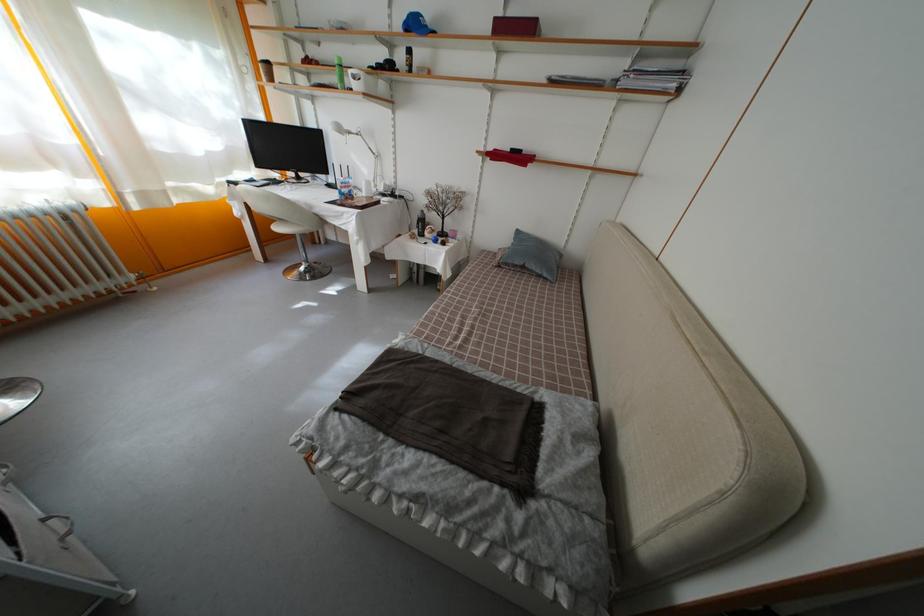
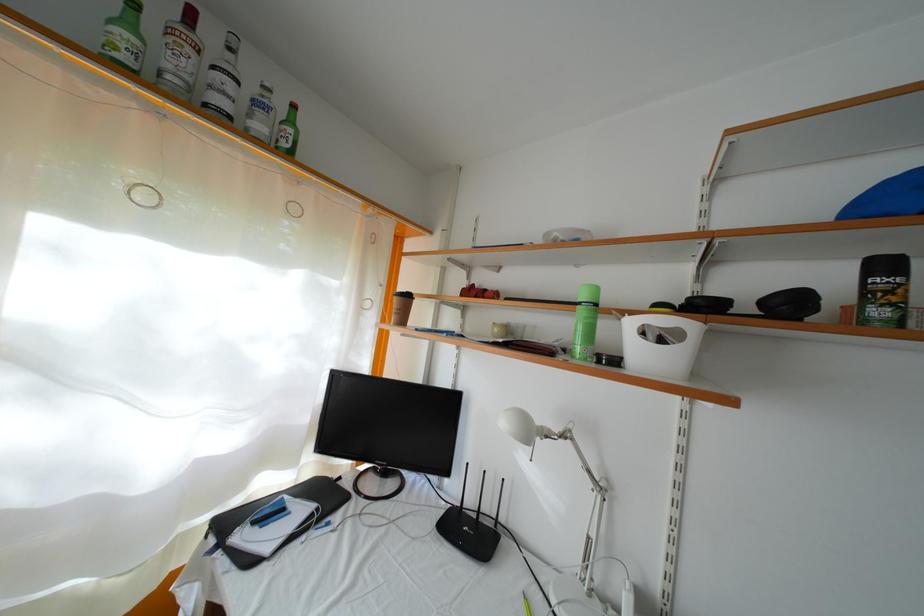
Where in the second image is the point corresponding to [416,58] from the first image?

(891, 273)